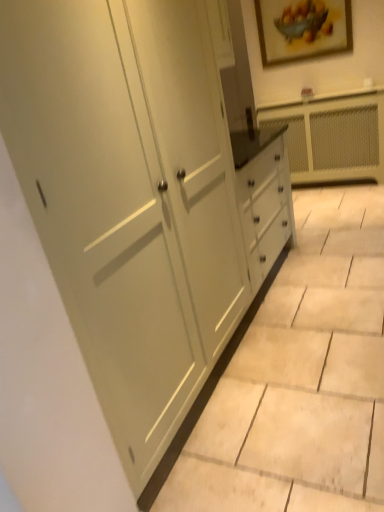
In order to face wooden framed picture at upper center, should I rotate leftwards or rightwards?

Rotate your view right by about 15.080°.

The height and width of the screenshot is (512, 384). What do you see at coordinates (302, 29) in the screenshot?
I see `wooden framed picture at upper center` at bounding box center [302, 29].

Find the location of a particular element. wooden framed picture at upper center is located at coordinates (302, 29).

At what (x,y) coordinates should I click in order to perform the action: click on wooden framed picture at upper center. Please return your answer as a coordinate pair (x, y). This screenshot has height=512, width=384. Looking at the image, I should click on (302, 29).